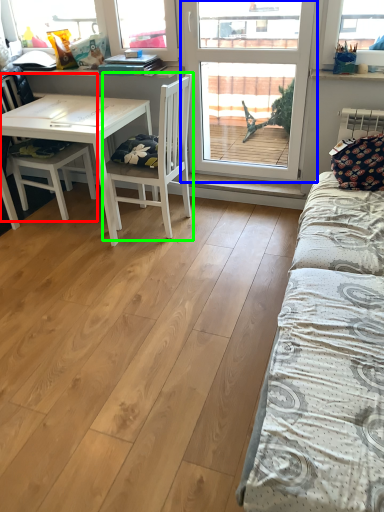
Question: Estimate the real-world distances between objects in this image. Which object is closer to chair (highlighted by a red box), window (highlighted by a blue box) or chair (highlighted by a green box)?

Choices:
 (A) window
 (B) chair

Answer: (B)